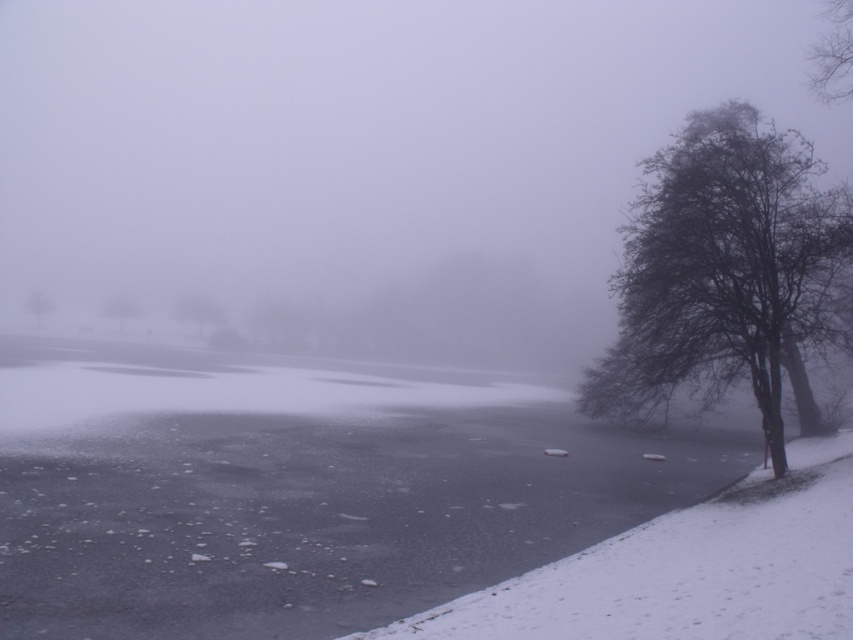
You are an observer standing in the winter scene and want to determine which object is shorter between the brown matte tree at center and the bare branches at left. Based on the scene, which one is shorter?

The brown matte tree at center is shorter than the bare branches at left.

You are planning to cross the frozen water in the image. You see the bare branches at upper right and the smooth gray tree at center. Which object is closer to the frozen water edge?

The bare branches at upper right is positioned on the right side of smooth gray tree at center, so the smooth gray tree at center is closer to the frozen water edge.

You are an observer standing on the snow near the edge of the frozen water. You notice two trees in the scene, the bare branches at upper right and the smooth gray tree at center. Which tree appears taller from your vantage point?

The bare branches at upper right appears taller than the smooth gray tree at center from your vantage point because the description states that the bare branches at upper right has a greater height compared to smooth gray tree at center.